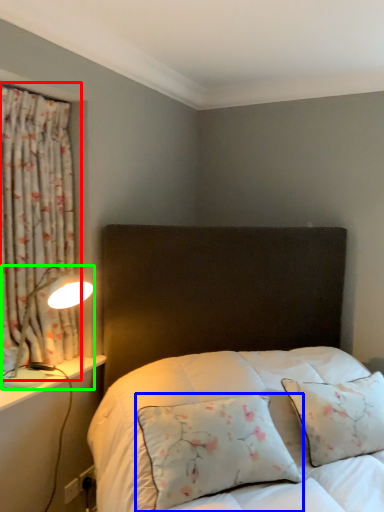
Question: Based on their relative distances, which object is nearer to curtain (highlighted by a red box)? Choose from pillow (highlighted by a blue box) and table lamp (highlighted by a green box).

Choices:
 (A) pillow
 (B) table lamp

Answer: (B)